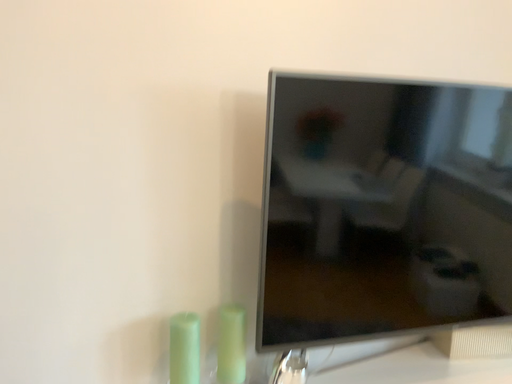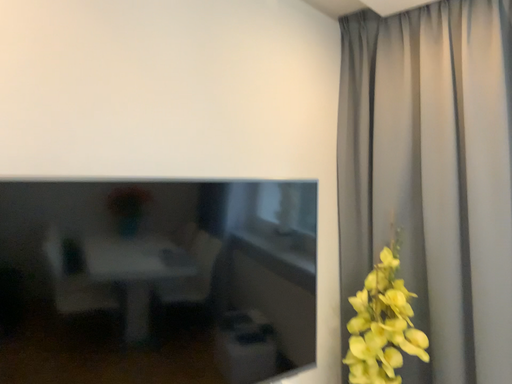
Question: Which way did the camera rotate in the video?

Choices:
 (A) rotated upward
 (B) rotated downward

Answer: (A)